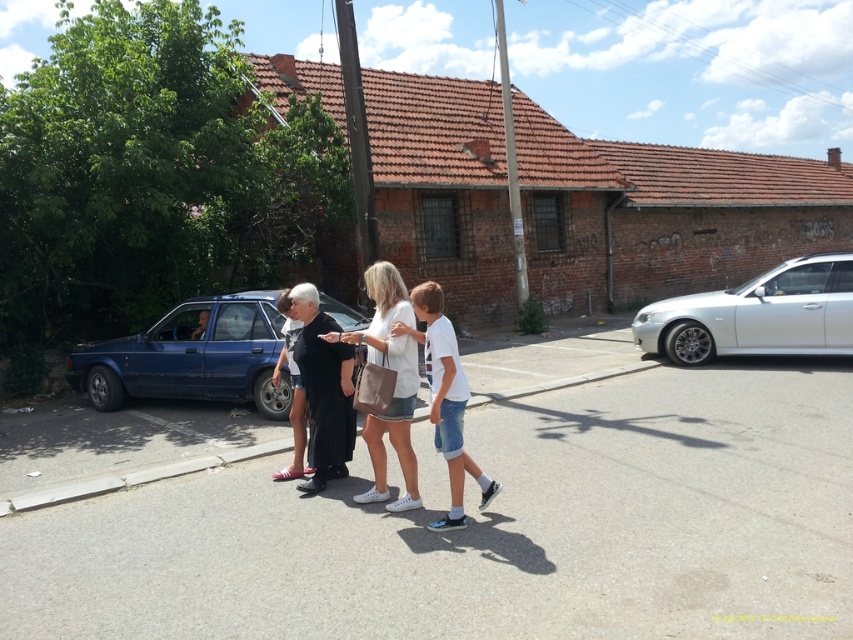
You are a photographer standing on the sidewalk. You want to take a photo of the white cotton shirt at center and the matte black car at left. Which object should you focus on first to ensure both are in sharp focus?

The white cotton shirt at center is closer to the viewer than the matte black car at left. To ensure both are in sharp focus, you should focus on the white cotton shirt at center because it is closer, and the matte black car at left will be within the depth of field if focused properly on the closer object.

You are a pedestrian on the sidewalk and want to cross the street to reach the brick building with the red roof. You see the white metallic car at right and the white matte shirt at center. Which object is closer to you as you stand on the sidewalk?

The white matte shirt at center is behind the white metallic car at right, so the white metallic car at right is closer to you.

You are a photographer taking a picture of the scene. You notice two points in the image at coordinates point [148,349] and point [192,336]. Which point is closer to your camera?

Point [148,349] is further to the camera than point [192,336], so the closer point to the camera is point [192,336].